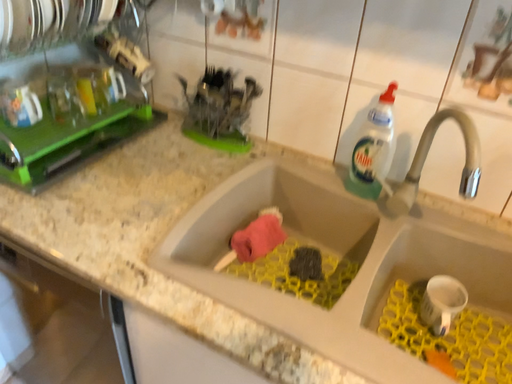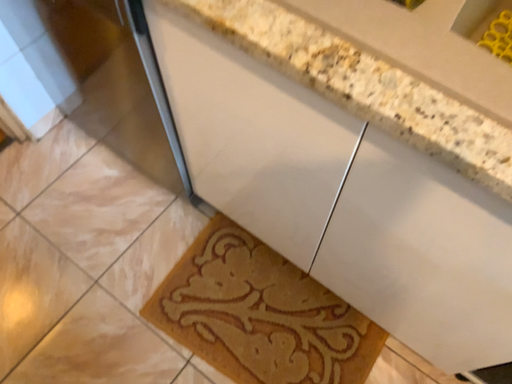
Question: How did the camera likely rotate when shooting the video?

Choices:
 (A) rotated left
 (B) rotated right

Answer: (A)